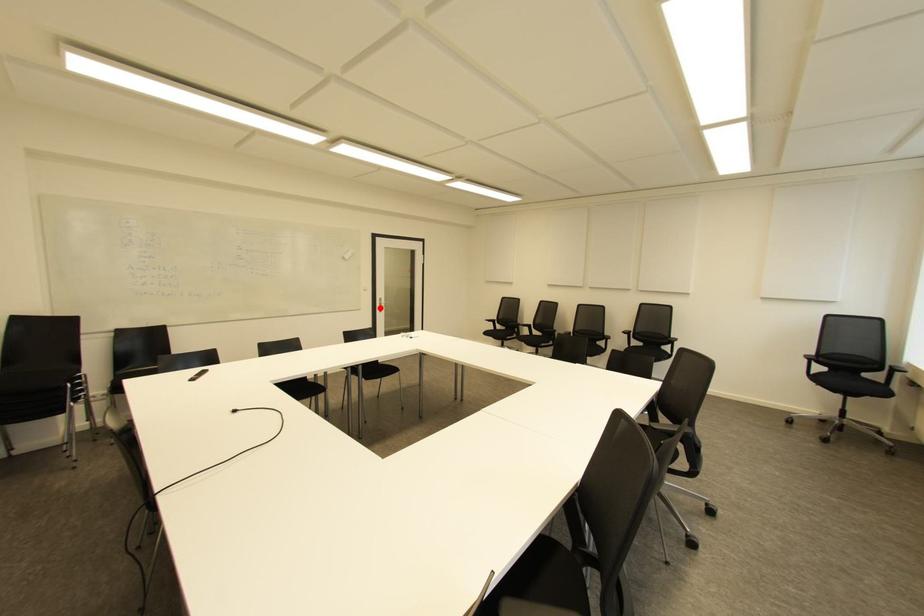
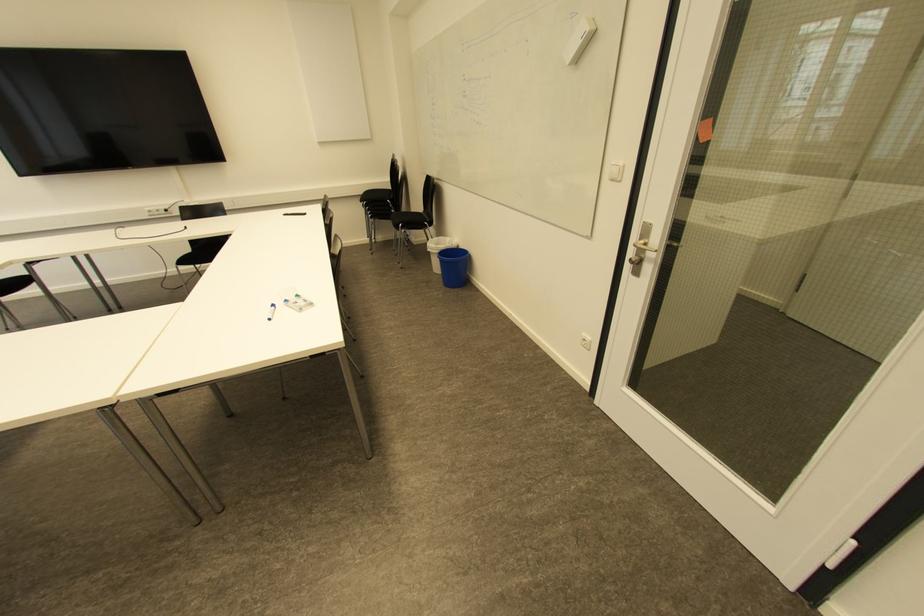
Find the pixel in the second image that matches the highlighted location in the first image.

(638, 262)